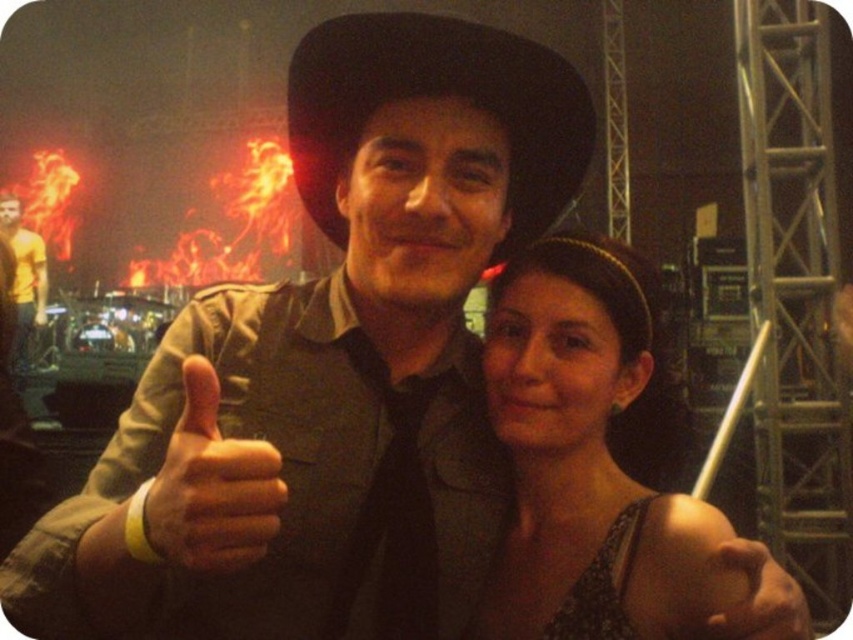
You are a photographer trying to capture the perfect shot of the matte black dress at center during the concert. Based on its position coordinates, where should you aim your camera?

The matte black dress at center is located at coordinates point [585,449], so you should aim your camera at that position to capture it.